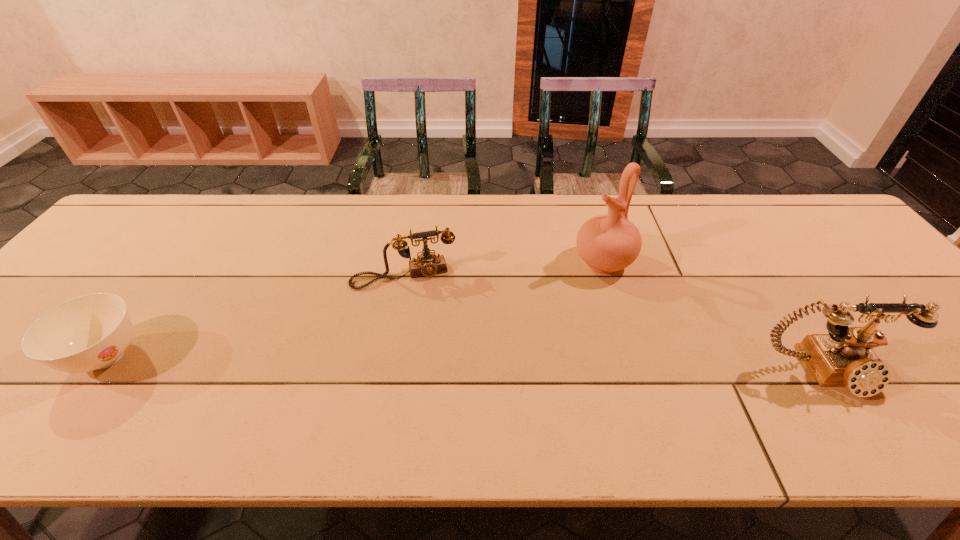
In order to click on unoccupied position between the sugar bowl and the nearer telephone in this screenshot , I will do `click(466, 364)`.

I want to click on unoccupied area between the pottery and the left telephone, so click(x=504, y=269).

I want to click on vacant area that lies between the second tallest object and the second shortest object, so click(x=614, y=324).

Point out which object is positioned as the second nearest to the leftmost object. Please provide its 2D coordinates. Your answer should be formatted as a tuple, i.e. [(x, y)], where the tuple contains the x and y coordinates of a point satisfying the conditions above.

[(608, 243)]

Select which object is the closest to the second object from left to right. Please provide its 2D coordinates. Your answer should be formatted as a tuple, i.e. [(x, y)], where the tuple contains the x and y coordinates of a point satisfying the conditions above.

[(608, 243)]